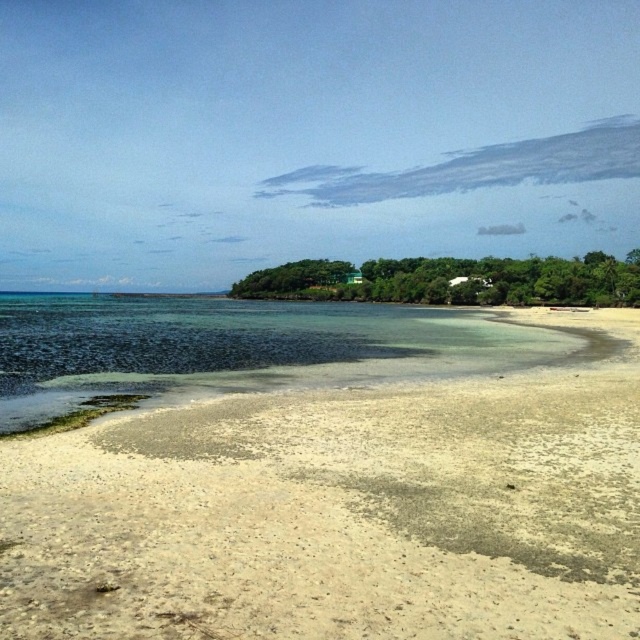
From the picture: Measure the distance between white sand beach at lower center and clear water at lower left.

7.59 meters

You are a GUI agent. You are given a task and a screenshot of the screen. Output one action in this format:
    pyautogui.click(x=<x>, y=<y>)
    Task: Click on the white sand beach at lower center
    The width and height of the screenshot is (640, 640).
    Given the screenshot: What is the action you would take?
    pyautogui.click(x=320, y=474)

Is point (588, 413) more distant than point (464, 337)?

No, (588, 413) is in front of (464, 337).

This screenshot has width=640, height=640. Identify the location of white sand beach at lower center. (320, 474).

Which of these two, white sand beach at lower center or green matte house at center, stands shorter?

white sand beach at lower center

Between white sand beach at lower center and green matte house at center, which one appears on the right side from the viewer's perspective?

green matte house at center is more to the right.

Is point (522, 525) closer to camera compared to point (378, 300)?

That is True.

At what (x,y) coordinates should I click in order to perform the action: click on white sand beach at lower center. Please return your answer as a coordinate pair (x, y). Looking at the image, I should click on (320, 474).

Does clear water at lower left have a lesser height compared to green matte house at center?

Correct, clear water at lower left is not as tall as green matte house at center.

Who is positioned more to the left, clear water at lower left or green matte house at center?

clear water at lower left

Is point (24, 346) more distant than point (524, 288)?

No.

You are a GUI agent. You are given a task and a screenshot of the screen. Output one action in this format:
    pyautogui.click(x=<x>, y=<y>)
    Task: Click on the clear water at lower left
    The height and width of the screenshot is (640, 640).
    Given the screenshot: What is the action you would take?
    pyautogui.click(x=234, y=348)